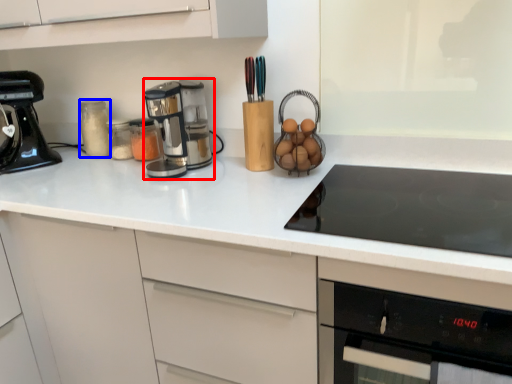
Question: Which point is closer to the camera, kitchen appliance (highlighted by a red box) or bottle (highlighted by a blue box)?

Choices:
 (A) kitchen appliance
 (B) bottle

Answer: (A)